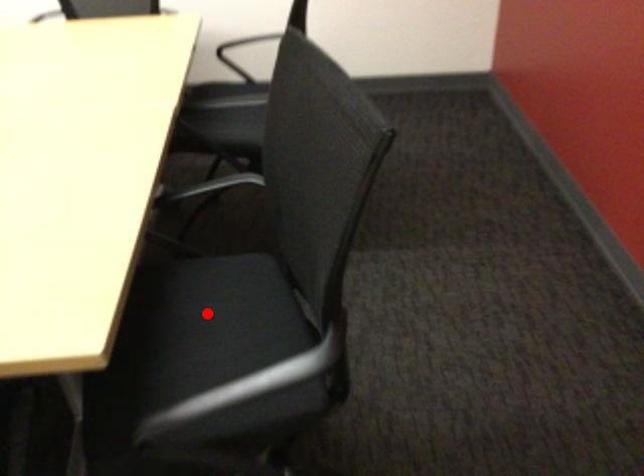
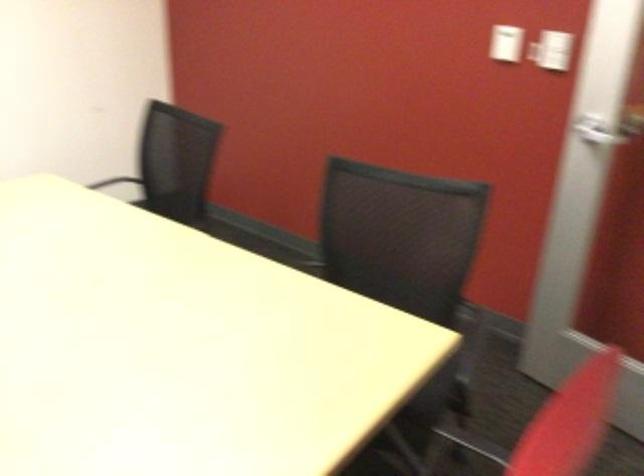
Question: I am providing you with two images of the same scene from different viewpoints. A red point is marked on the first image. At the location where the point appears in image 1, is it still visible in image 2?

Choices:
 (A) Yes
 (B) No

Answer: (B)